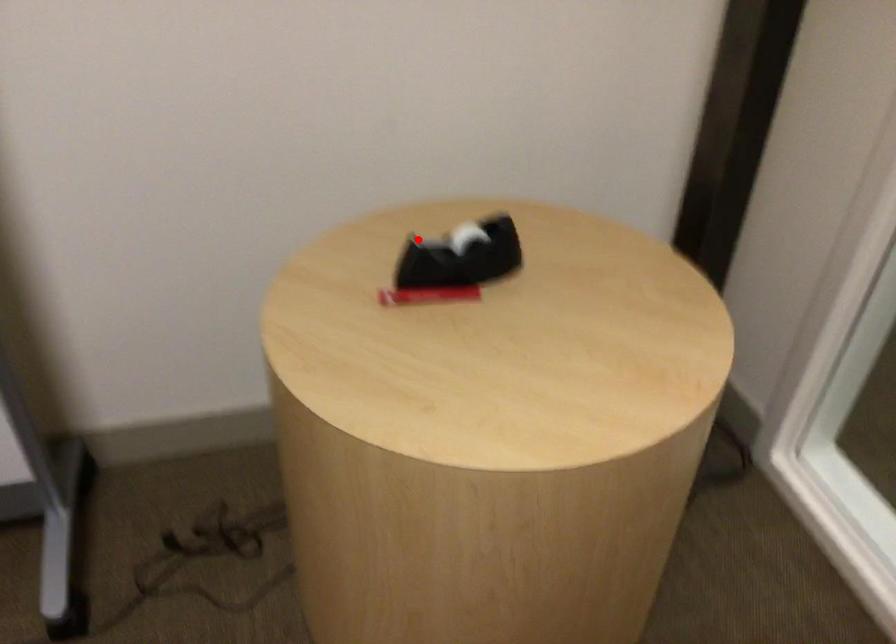
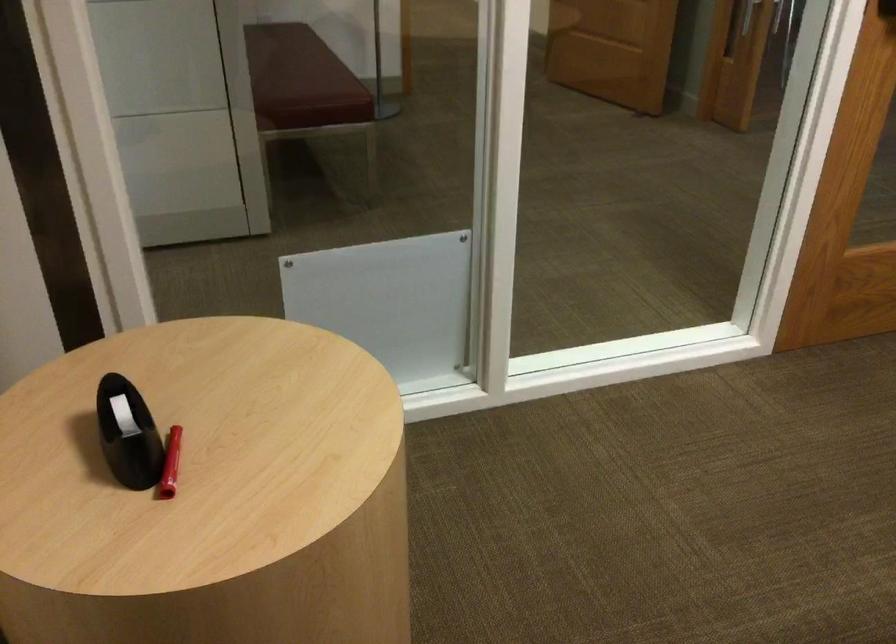
Locate, in the second image, the point that corresponds to the highlighted location in the first image.

(127, 433)